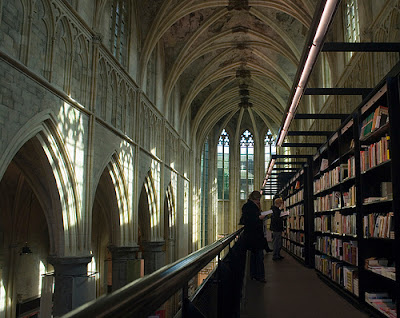
Image resolution: width=400 pixels, height=318 pixels. I want to click on windows, so click(205, 161), click(227, 169), click(245, 165), click(266, 160), click(286, 152), click(311, 118), click(329, 80), click(354, 32), click(112, 35), click(148, 74).